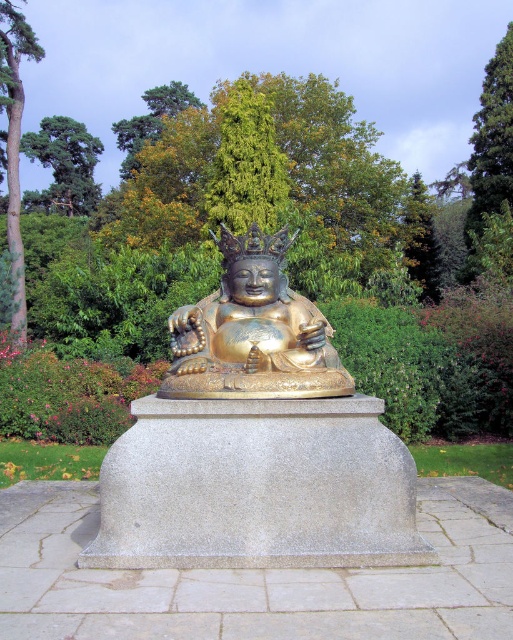
Question: Which of the following is the farthest from the observer?

Choices:
 (A) (487, 131)
 (B) (25, 320)
 (C) (203, 358)

Answer: (A)

Question: Which is farther from the gold polished statue at center?

Choices:
 (A) green leafy tree at upper right
 (B) brushed metal tree at left

Answer: (A)

Question: Can you confirm if green leafy tree at upper right is bigger than green leafy tree at upper left?

Choices:
 (A) yes
 (B) no

Answer: (A)

Question: Is gold polished statue at center wider than green leafy tree at upper left?

Choices:
 (A) no
 (B) yes

Answer: (A)

Question: Does brushed metal tree at left lie behind green leafy tree at upper left?

Choices:
 (A) no
 (B) yes

Answer: (A)

Question: Which point is farther to the camera?

Choices:
 (A) (324, 339)
 (B) (18, 145)
 (C) (466, 236)

Answer: (C)